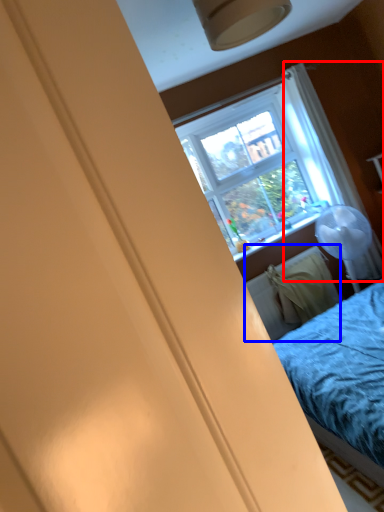
Question: Which of the following is the closest to the observer, curtain (highlighted by a red box) or radiator (highlighted by a blue box)?

Choices:
 (A) curtain
 (B) radiator

Answer: (B)